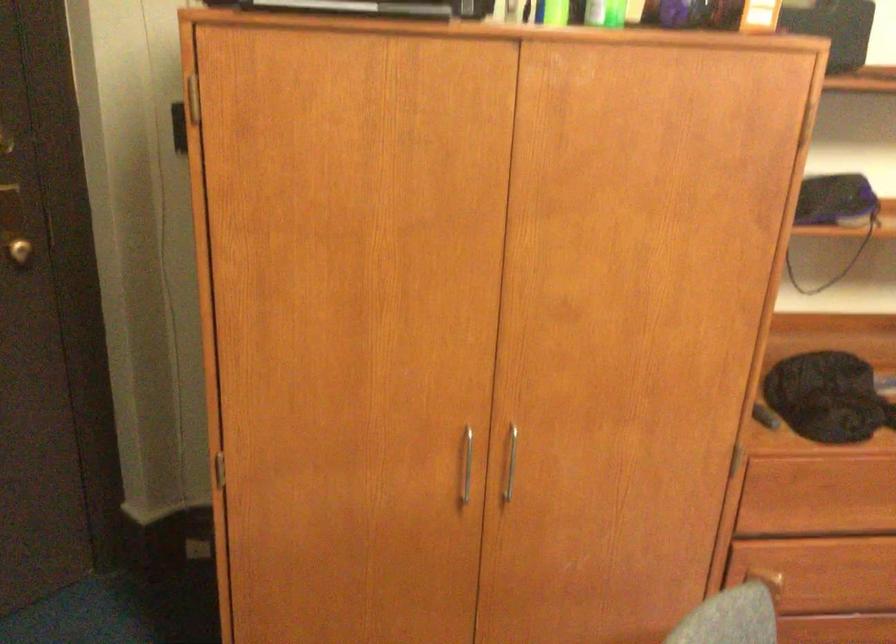
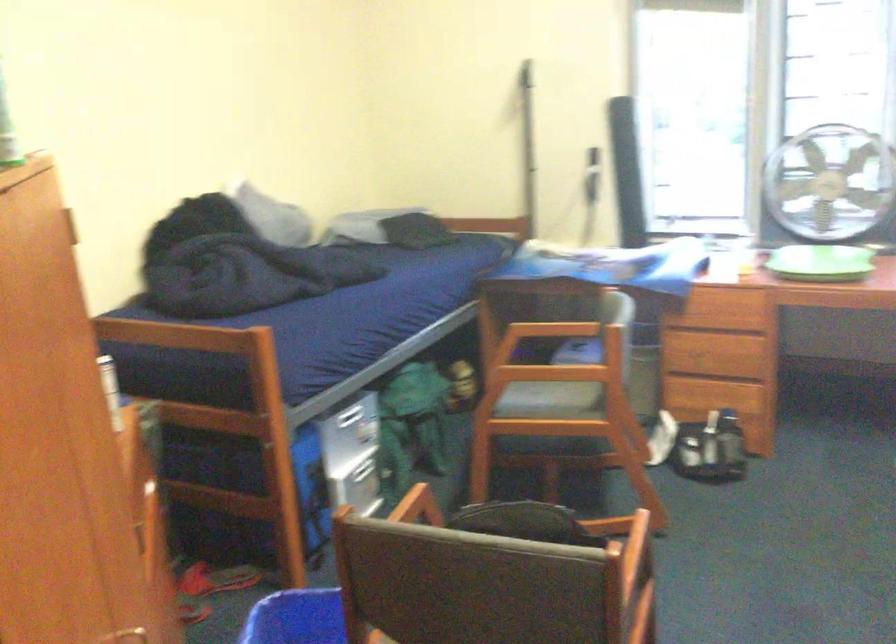
Question: I am providing you with two images of the same scene from different viewpoints. After the viewpoint changes to image2, which objects are now occluded?

Choices:
 (A) silver drawer handle
 (B) drawer handle
 (C) pink shampoo bottle
 (D) dark chair seat

Answer: (B)